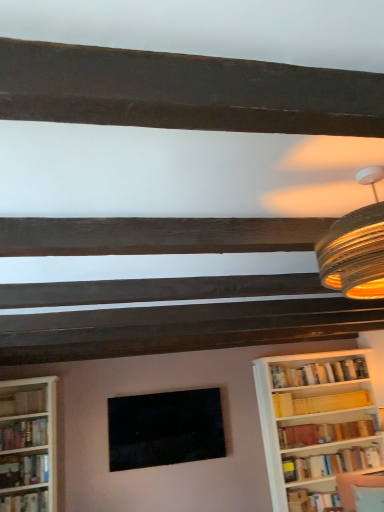
The image size is (384, 512). Describe the element at coordinates (23, 434) in the screenshot. I see `hardcover book at left, which ranks as the second book in left-to-right order` at that location.

Measure the distance between point (50, 505) and camera.

4.02 meters.

Where is `hardcover book at lower right, which appears as the third book when viewed from the right`? The image size is (384, 512). hardcover book at lower right, which appears as the third book when viewed from the right is located at coordinates (313, 501).

What do you see at coordinates (356, 486) in the screenshot? I see `velvet fabric swivel chair at lower right` at bounding box center [356, 486].

The width and height of the screenshot is (384, 512). What are the coordinates of `hardcover book at lower left, which is the 4th book from right to left` in the screenshot? It's located at (23, 470).

At what (x,y) coordinates should I click in order to perform the action: click on hardcover book at left, positioned as the 6th book in right-to-left order. Please return your answer as a coordinate pair (x, y). The width and height of the screenshot is (384, 512). Looking at the image, I should click on (23, 434).

From the hardcover book at left, which ranks as the 3th book in left-to-right order, count 4th books backward and point to it. Please provide its 2D coordinates.

[(313, 501)]

Is hardcover book at lower right, the 5th book from the left, wider than hardcover book at left, positioned as the fifth book in right-to-left order?

No, hardcover book at lower right, the 5th book from the left, is not wider than hardcover book at left, positioned as the fifth book in right-to-left order.

Does hardcover book at lower right, the 5th book from the left, come behind hardcover book at left, which ranks as the 3th book in left-to-right order?

Yes, hardcover book at lower right, the 5th book from the left, is further from the camera.

Based on the photo, is hardcover book at lower right, which appears as the third book when viewed from the right, placed right next to hardcover book at left, which ranks as the 3th book in left-to-right order?

No, hardcover book at lower right, which appears as the third book when viewed from the right, is not in contact with hardcover book at left, which ranks as the 3th book in left-to-right order.

From a real-world perspective, is hardcover book at left, which ranks as the 3th book in left-to-right order, physically located above or below matte yellow bookshelf at right, which is the 6th book from left to right?

hardcover book at left, which ranks as the 3th book in left-to-right order, is below matte yellow bookshelf at right, which is the 6th book from left to right.

Based on the photo, from the image's perspective, which is above, hardcover book at left, positioned as the fifth book in right-to-left order, or matte yellow bookshelf at right, marked as the 2th book in a right-to-left arrangement?

From the image's view, matte yellow bookshelf at right, marked as the 2th book in a right-to-left arrangement, is above.

Between hardcover book at left, positioned as the fifth book in right-to-left order, and matte yellow bookshelf at right, which is the 6th book from left to right, which one appears on the left side from the viewer's perspective?

hardcover book at left, positioned as the fifth book in right-to-left order, is more to the left.

Does hardcover book at left, positioned as the fifth book in right-to-left order, have a greater width compared to matte yellow bookshelf at right, which is the 6th book from left to right?

Yes, hardcover book at left, positioned as the fifth book in right-to-left order, is wider than matte yellow bookshelf at right, which is the 6th book from left to right.

Is white wood bookcase at left completely or partially outside of hardcover book at left, which ranks as the 3th book in left-to-right order?

Absolutely, white wood bookcase at left is external to hardcover book at left, which ranks as the 3th book in left-to-right order.

From a real-world perspective, relative to hardcover book at left, which ranks as the 3th book in left-to-right order, is white wood bookcase at left vertically above or below?

→ white wood bookcase at left is above hardcover book at left, which ranks as the 3th book in left-to-right order.

Which point is more forward, (3, 400) or (48, 501)?

The point (48, 501) is in front.

Which of these two, velvet fabric swivel chair at lower right or matte yellow bookshelf at right, marked as the 2th book in a right-to-left arrangement, stands taller?

velvet fabric swivel chair at lower right.

Considering the sizes of velvet fabric swivel chair at lower right and matte yellow bookshelf at right, marked as the 2th book in a right-to-left arrangement, in the image, is velvet fabric swivel chair at lower right bigger or smaller than matte yellow bookshelf at right, marked as the 2th book in a right-to-left arrangement,?

Considering their sizes, velvet fabric swivel chair at lower right takes up less space than matte yellow bookshelf at right, marked as the 2th book in a right-to-left arrangement.

In the scene shown: Between velvet fabric swivel chair at lower right and matte yellow bookshelf at right, marked as the 2th book in a right-to-left arrangement, which one appears on the left side from the viewer's perspective?

Positioned to the left is matte yellow bookshelf at right, marked as the 2th book in a right-to-left arrangement.

Find the location of a particular element. This screenshot has width=384, height=512. the 6th book behind the velvet fabric swivel chair at lower right is located at coordinates (318, 403).

Does point (339, 474) lie behind point (37, 505)?

Yes, point (339, 474) is farther from viewer.

From a real-world perspective, count 2nd books upward from the velvet fabric swivel chair at lower right and point to it. Please provide its 2D coordinates.

[(26, 502)]

From a real-world perspective, who is located higher, velvet fabric swivel chair at lower right or hardcover book at left, positioned as the fifth book in right-to-left order?

hardcover book at left, positioned as the fifth book in right-to-left order, is physically above.

How distant is velvet fabric swivel chair at lower right from hardcover book at left, positioned as the fifth book in right-to-left order?

A distance of 11.72 feet exists between velvet fabric swivel chair at lower right and hardcover book at left, positioned as the fifth book in right-to-left order.

Where is `picture frame that is on the right side of hardcover book at lower left, acting as the 4th book starting from the left`? Image resolution: width=384 pixels, height=512 pixels. picture frame that is on the right side of hardcover book at lower left, acting as the 4th book starting from the left is located at coordinates (165, 429).

Considering the relative sizes of matte black picture frame at center and hardcover book at lower left, acting as the 4th book starting from the left, in the image provided, is matte black picture frame at center smaller than hardcover book at lower left, acting as the 4th book starting from the left,?

Incorrect, matte black picture frame at center is not smaller in size than hardcover book at lower left, acting as the 4th book starting from the left.

Between matte black picture frame at center and hardcover book at lower left, which is the 4th book from right to left, which one has more height?

matte black picture frame at center.

Would you say matte black picture frame at center is to the left or to the right of hardcover book at lower left, which is the 4th book from right to left, in the picture?

In the image, matte black picture frame at center appears on the right side of hardcover book at lower left, which is the 4th book from right to left.

From a real-world perspective, is hardcover book at left, positioned as the 6th book in right-to-left order, positioned under wooden bookshelf at left, the first book viewed from the left, based on gravity?

Yes, from a real-world perspective, hardcover book at left, positioned as the 6th book in right-to-left order, is below wooden bookshelf at left, the first book viewed from the left.

Which book is the 1st one when counting from the back of the hardcover book at left, positioned as the 6th book in right-to-left order? Please provide its 2D coordinates.

[(23, 402)]

From the picture: From the image's perspective, is hardcover book at left, positioned as the 6th book in right-to-left order, under wooden bookshelf at left, the first book viewed from the left?

Yes, from the image's perspective, hardcover book at left, positioned as the 6th book in right-to-left order, is beneath wooden bookshelf at left, the first book viewed from the left.

Based on the photo, could you tell me if hardcover book at left, which ranks as the second book in left-to-right order, is turned towards wooden bookshelf at left, the first book viewed from the left?

No, hardcover book at left, which ranks as the second book in left-to-right order, does not turn towards wooden bookshelf at left, the first book viewed from the left.

Find the location of a particular element. This screenshot has width=384, height=512. the 1st book above the hardcover book at lower right, the 5th book from the left (from the image's perspective) is located at coordinates (26, 502).

Where is `book that is the 3rd object to the right of the hardcover book at left, positioned as the fifth book in right-to-left order, starting at the anchor`? This screenshot has width=384, height=512. book that is the 3rd object to the right of the hardcover book at left, positioned as the fifth book in right-to-left order, starting at the anchor is located at coordinates (318, 403).

From the image, which object appears to be nearer to white wood bookcase at left, hardcover book at lower right, the 5th book from the left, or hardcover book at left, positioned as the fifth book in right-to-left order?

The object closer to white wood bookcase at left is hardcover book at left, positioned as the fifth book in right-to-left order.

Which object lies further to the anchor point wooden bookshelf at left, placed as the seventh book when sorted from right to left, matte black picture frame at center or velvet fabric swivel chair at lower right?

Among the two, velvet fabric swivel chair at lower right is located further to wooden bookshelf at left, placed as the seventh book when sorted from right to left.

Looking at this image, when comparing their distances from white wood bookcase at left, does velvet fabric swivel chair at lower right or hardcover book at lower right, the 5th book from the left, seem further?

Among the two, velvet fabric swivel chair at lower right is located further to white wood bookcase at left.

Which object lies nearer to the anchor point white wood bookcase at left, hardcover book at lower right, the 5th book from the left, or velvet fabric swivel chair at lower right?

hardcover book at lower right, the 5th book from the left, is closer to white wood bookcase at left.

Estimate the real-world distances between objects in this image. Which object is closer to hardcover book at right, arranged as the 1th book when viewed from the right, matte black picture frame at center or hardcover book at left, positioned as the 6th book in right-to-left order?

matte black picture frame at center lies closer to hardcover book at right, arranged as the 1th book when viewed from the right, than the other object.

Considering their positions, is white wood bookcase at left positioned further to matte yellow bookshelf at right, marked as the 2th book in a right-to-left arrangement, than hardcover book at right, positioned as the 7th book in left-to-right order?

The object further to matte yellow bookshelf at right, marked as the 2th book in a right-to-left arrangement, is white wood bookcase at left.

Based on their spatial positions, is matte yellow bookshelf at right, which is the 6th book from left to right, or velvet fabric swivel chair at lower right closer to hardcover book at left, positioned as the 6th book in right-to-left order?

The object closer to hardcover book at left, positioned as the 6th book in right-to-left order, is matte yellow bookshelf at right, which is the 6th book from left to right.

When comparing their distances from white wood bookcase at left, does hardcover book at left, positioned as the fifth book in right-to-left order, or matte black picture frame at center seem further?

matte black picture frame at center.

At what (x,y) coordinates should I click in order to perform the action: click on bookcase located between wooden bookshelf at left, the first book viewed from the left, and hardcover book at lower right, which appears as the third book when viewed from the right, in the left-right direction. Please return your answer as a coordinate pair (x, y). The image size is (384, 512). Looking at the image, I should click on (28, 445).

The height and width of the screenshot is (512, 384). Find the location of `bookcase between wooden bookshelf at left, placed as the seventh book when sorted from right to left, and matte black picture frame at center`. bookcase between wooden bookshelf at left, placed as the seventh book when sorted from right to left, and matte black picture frame at center is located at coordinates (28, 445).

Image resolution: width=384 pixels, height=512 pixels. I want to click on book between hardcover book at lower left, which is the 4th book from right to left, and matte yellow bookshelf at right, marked as the 2th book in a right-to-left arrangement, from left to right, so click(313, 501).

Where is `picture frame between hardcover book at left, which ranks as the 3th book in left-to-right order, and velvet fabric swivel chair at lower right, in the horizontal direction`? picture frame between hardcover book at left, which ranks as the 3th book in left-to-right order, and velvet fabric swivel chair at lower right, in the horizontal direction is located at coordinates (165, 429).